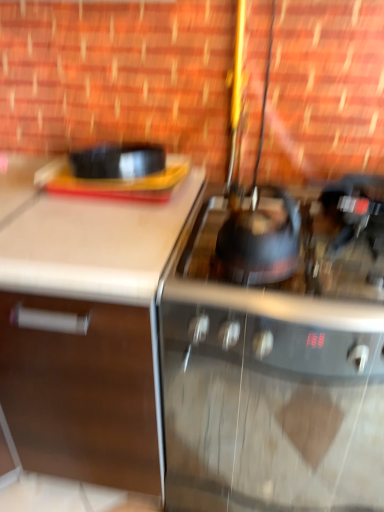
Question: Does shiny black kettle at center, the 1th gas stove in the top-to-bottom sequence, appear on the left side of stainless steel gas stove at center, which ranks as the 1th gas stove in bottom-to-top order?

Choices:
 (A) no
 (B) yes

Answer: (B)

Question: Does shiny black kettle at center, the 1th gas stove in the top-to-bottom sequence, have a greater width compared to stainless steel gas stove at center, which ranks as the 1th gas stove in bottom-to-top order?

Choices:
 (A) no
 (B) yes

Answer: (B)

Question: From a real-world perspective, is shiny black kettle at center, the 1th gas stove in the top-to-bottom sequence, physically above stainless steel gas stove at center, the 2th gas stove when ordered from top to bottom?

Choices:
 (A) yes
 (B) no

Answer: (A)

Question: Is stainless steel gas stove at center, which ranks as the 1th gas stove in bottom-to-top order, at the back of shiny black kettle at center, the second gas stove when ordered from bottom to top?

Choices:
 (A) yes
 (B) no

Answer: (B)

Question: Can you confirm if shiny black kettle at center, the 1th gas stove in the top-to-bottom sequence, is smaller than stainless steel gas stove at center, which ranks as the 1th gas stove in bottom-to-top order?

Choices:
 (A) no
 (B) yes

Answer: (B)

Question: Would you say white matte cabinet at left is inside or outside stainless steel gas stove at center, the 2th gas stove when ordered from top to bottom?

Choices:
 (A) inside
 (B) outside

Answer: (B)

Question: From a real-world perspective, is white matte cabinet at left physically located above or below stainless steel gas stove at center, which ranks as the 1th gas stove in bottom-to-top order?

Choices:
 (A) above
 (B) below

Answer: (A)

Question: In terms of size, does white matte cabinet at left appear bigger or smaller than stainless steel gas stove at center, the 2th gas stove when ordered from top to bottom?

Choices:
 (A) small
 (B) big

Answer: (B)

Question: From the image's perspective, is white matte cabinet at left above or below stainless steel gas stove at center, the 2th gas stove when ordered from top to bottom?

Choices:
 (A) above
 (B) below

Answer: (A)

Question: Is point (218, 424) closer or farther from the camera than point (238, 243)?

Choices:
 (A) closer
 (B) farther

Answer: (B)

Question: From a real-world perspective, is stainless steel gas stove at center, which ranks as the 1th gas stove in bottom-to-top order, physically located above or below shiny black kettle at center?

Choices:
 (A) above
 (B) below

Answer: (B)

Question: In terms of height, does stainless steel gas stove at center, the 2th gas stove when ordered from top to bottom, look taller or shorter compared to shiny black kettle at center?

Choices:
 (A) short
 (B) tall

Answer: (B)

Question: Looking at the image, does stainless steel gas stove at center, the 2th gas stove when ordered from top to bottom, seem bigger or smaller compared to shiny black kettle at center?

Choices:
 (A) big
 (B) small

Answer: (A)

Question: Is shiny black kettle at center, the second gas stove when ordered from bottom to top, taller or shorter than stainless steel gas stove at center, which ranks as the 1th gas stove in bottom-to-top order?

Choices:
 (A) tall
 (B) short

Answer: (B)

Question: Considering the positions of shiny black kettle at center, the 1th gas stove in the top-to-bottom sequence, and stainless steel gas stove at center, which ranks as the 1th gas stove in bottom-to-top order, in the image, is shiny black kettle at center, the 1th gas stove in the top-to-bottom sequence, wider or thinner than stainless steel gas stove at center, which ranks as the 1th gas stove in bottom-to-top order,?

Choices:
 (A) thin
 (B) wide

Answer: (B)